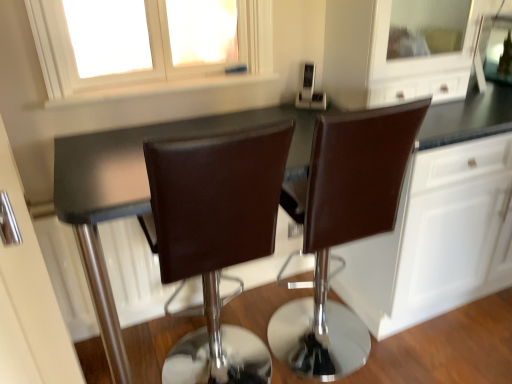
Question: From their relative heights in the image, would you say white matte window at upper center is taller or shorter than brown leather chair at center, which is the 1th chair in left-to-right order?

Choices:
 (A) short
 (B) tall

Answer: (A)

Question: Is point (254, 49) closer or farther from the camera than point (250, 248)?

Choices:
 (A) farther
 (B) closer

Answer: (A)

Question: Which object is the closest to the brown leather chair at center, positioned as the 2th chair in left-to-right order?

Choices:
 (A) white matte window at upper center
 (B) brown leather chair at center, positioned as the 2th chair in right-to-left order
 (C) white glossy cabinetry at right
 (D) satin silver toaster at upper center
 (E) black glossy countertop at center

Answer: (C)

Question: Which object is positioned closest to the white glossy cabinetry at right?

Choices:
 (A) black glossy countertop at center
 (B) brown leather chair at center, which is counted as the first chair, starting from the right
 (C) brown leather chair at center, which is the 1th chair in left-to-right order
 (D) satin silver toaster at upper center
 (E) white matte window at upper center

Answer: (B)